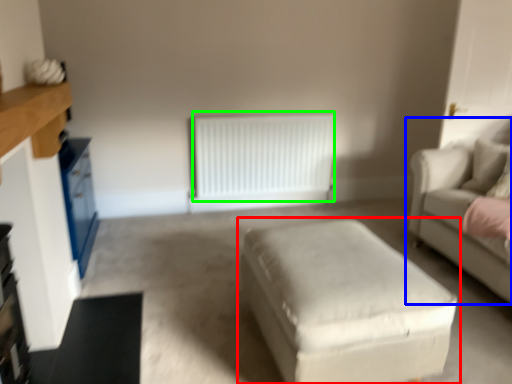
Question: Considering the real-world distances, which object is farthest from table (highlighted by a red box)? studio couch (highlighted by a blue box) or radiator (highlighted by a green box)?

Choices:
 (A) studio couch
 (B) radiator

Answer: (B)